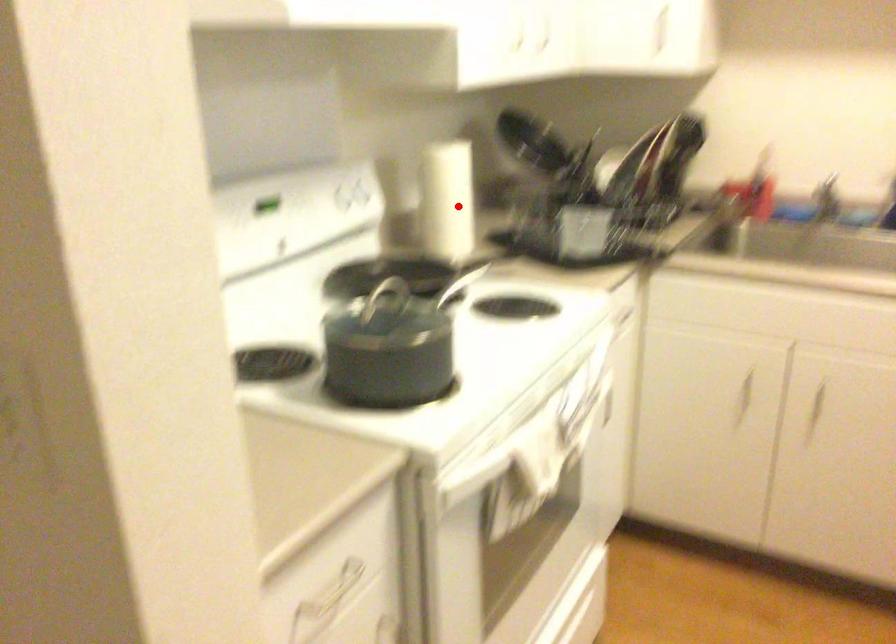
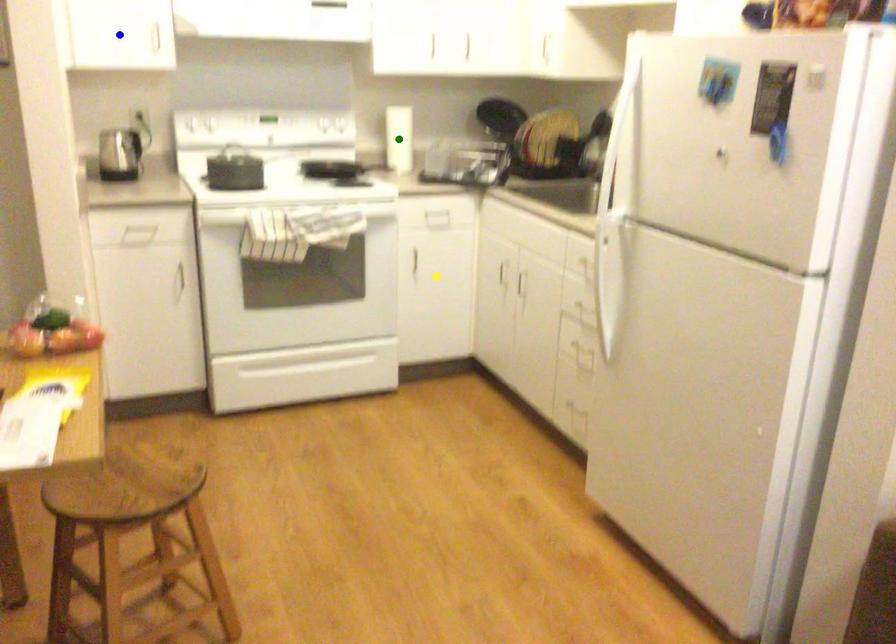
Question: I am providing you with two images of the same scene from different viewpoints. A red point is marked on the first image. You are given multiple points on the second image. Which spot in image 2 lines up with the point in image 1?

Choices:
 (A) blue point
 (B) green point
 (C) yellow point

Answer: (B)